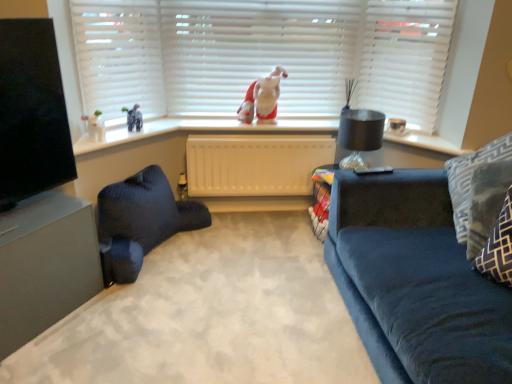
Identify the location of free space to the right of dark blue fabric studio couch at lower left, the 2th studio couch in the right-to-left sequence. (238, 255).